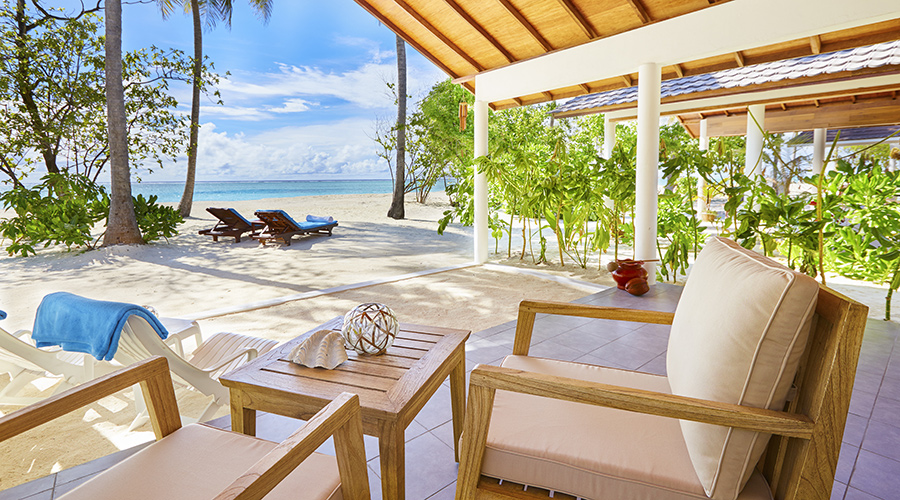
Identify the location of columns. This screenshot has height=500, width=900. (474, 116), (604, 134), (644, 120), (705, 129), (756, 140), (814, 144).